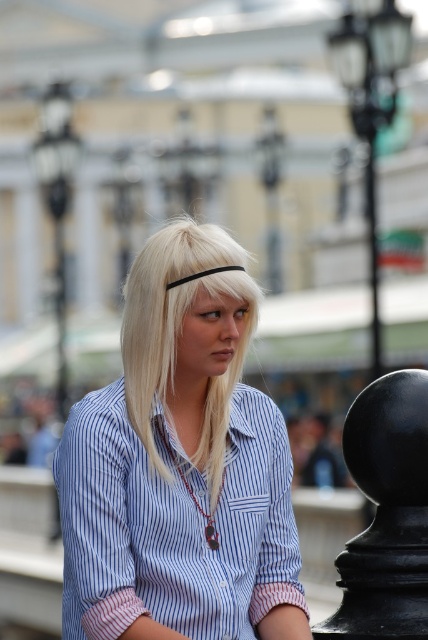
Who is lower down, blue striped shirt at center or blonde hair at center?

blue striped shirt at center is below.

Is blue striped shirt at center above blonde hair at center?

Incorrect, blue striped shirt at center is not positioned above blonde hair at center.

Does point (145, 609) come behind point (205, 227)?

No, it is not.

I want to click on blue striped shirt at center, so click(178, 460).